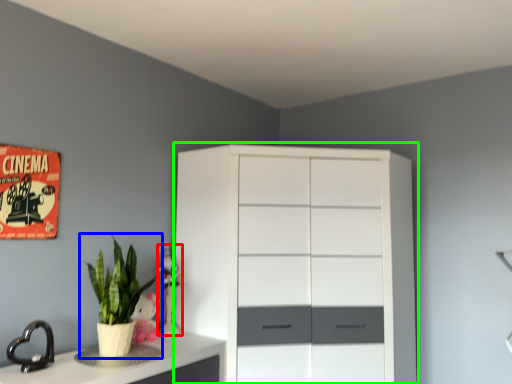
Question: Which is farther away from toy (highlighted by a red box)? houseplant (highlighted by a blue box) or chest of drawers (highlighted by a green box)?

Choices:
 (A) houseplant
 (B) chest of drawers

Answer: (B)